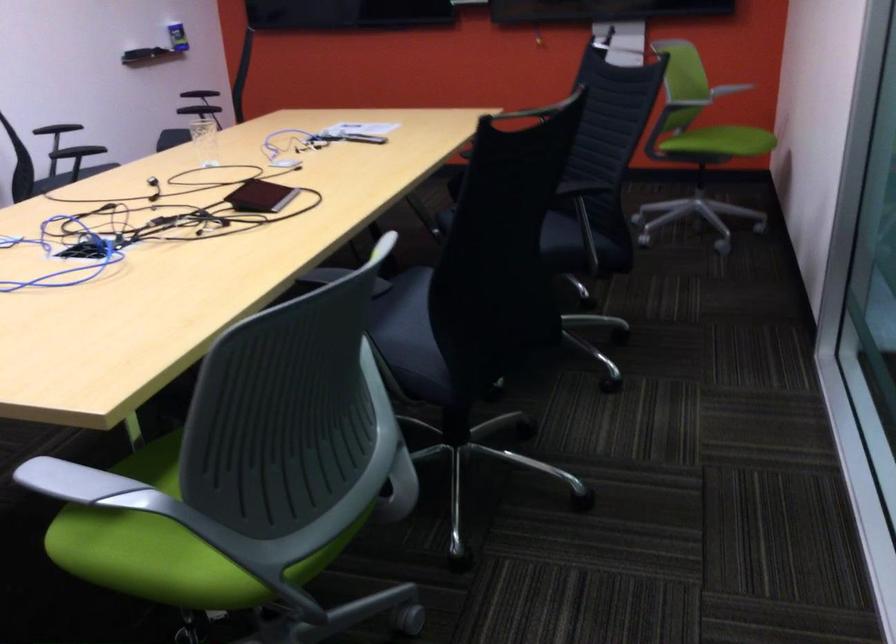
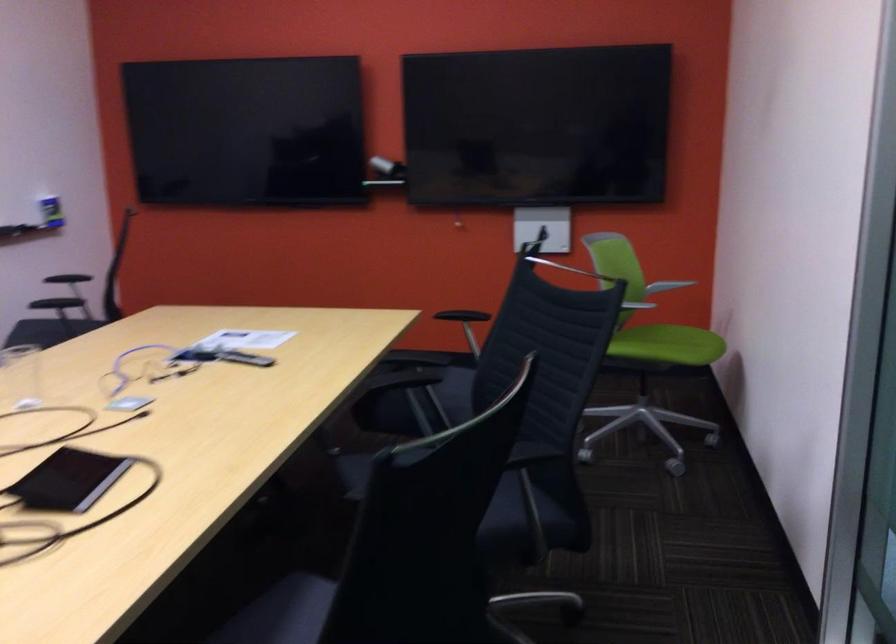
Question: Which direction would the cameraman need to move to produce the second image? Reply with the corresponding letter.

Choices:
 (A) Left
 (B) Right
 (C) Forward
 (D) Backward

Answer: (C)